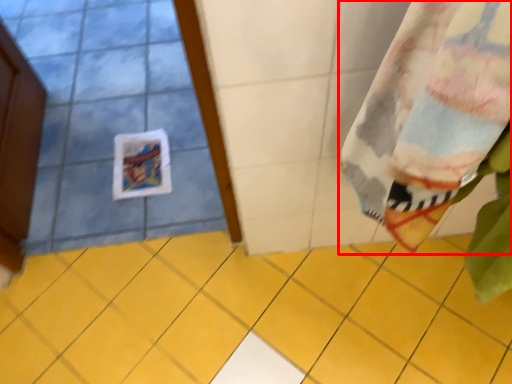
Question: In this image, where is curtain (annotated by the red box) located relative to ceramic tile?

Choices:
 (A) right
 (B) left

Answer: (A)